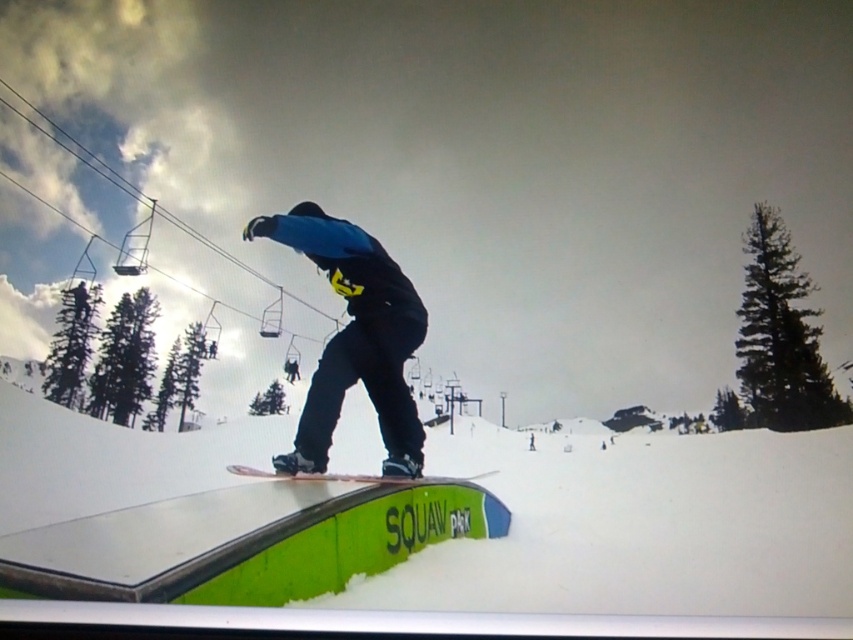
Can you confirm if matte black snowboarder at center is bigger than white matte snowboard at center?

No.

Which of these two, matte black snowboarder at center or white matte snowboard at center, stands shorter?

Standing shorter between the two is matte black snowboarder at center.

Which is in front, point (364, 353) or point (250, 468)?

Point (364, 353) is in front.

Where is `matte black snowboarder at center`? This screenshot has width=853, height=640. matte black snowboarder at center is located at coordinates (354, 339).

The height and width of the screenshot is (640, 853). Find the location of `white matte snow at center`. white matte snow at center is located at coordinates (640, 525).

Is point (514, 493) behind point (381, 480)?

Yes, point (514, 493) is farther from viewer.

Find the location of a particular element. white matte snow at center is located at coordinates (640, 525).

Between point (495, 544) and point (311, 456), which one is positioned behind?

The point (495, 544) is more distant.

Which is behind, point (526, 531) or point (312, 422)?

The point (526, 531) is more distant.

The image size is (853, 640). Find the location of `white matte snow at center`. white matte snow at center is located at coordinates (640, 525).